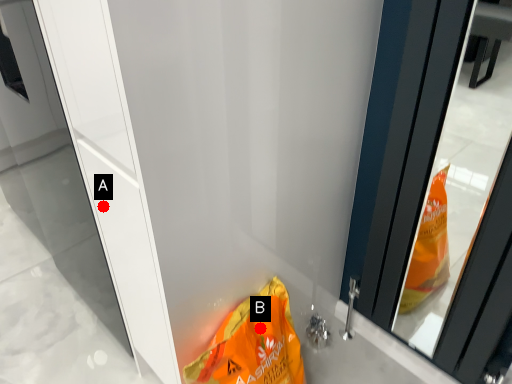
Question: Two points are circled on the image, labeled by A and B beside each circle. Which of the following is the closest to the observer?

Choices:
 (A) A is closer
 (B) B is closer

Answer: (A)